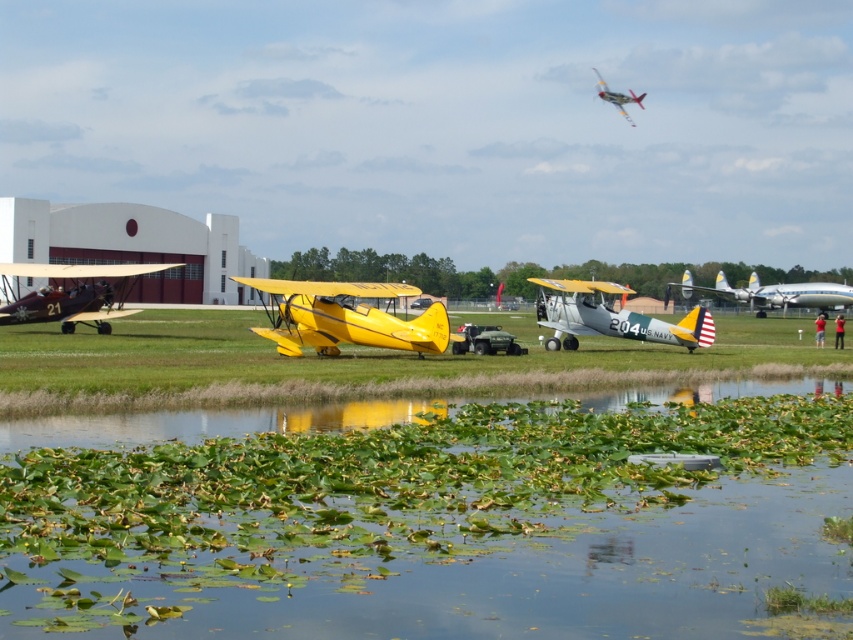
Is matte yellow biplane at left positioned at the back of silver metallic airplane at center right?

That is False.

Which is more to the left, matte yellow biplane at left or silver metallic airplane at center right?

From the viewer's perspective, matte yellow biplane at left appears more on the left side.

Who is more distant from viewer, (102, 289) or (704, 288)?

Point (704, 288)

At what (x,y) coordinates should I click in order to perform the action: click on matte yellow biplane at left. Please return your answer as a coordinate pair (x, y). Looking at the image, I should click on (73, 292).

What do you see at coordinates (428, 518) in the screenshot? The image size is (853, 640). I see `green leafy water at lower center` at bounding box center [428, 518].

Locate an element on the screen. green leafy water at lower center is located at coordinates (428, 518).

Does yellow matte airplane at center have a lesser width compared to silver metallic airplane at center?

Incorrect, yellow matte airplane at center's width is not less than silver metallic airplane at center's.

Is the position of yellow matte airplane at center less distant than that of silver metallic airplane at center?

Yes, yellow matte airplane at center is in front of silver metallic airplane at center.

Find the location of `yellow matte airplane at center`. yellow matte airplane at center is located at coordinates (347, 316).